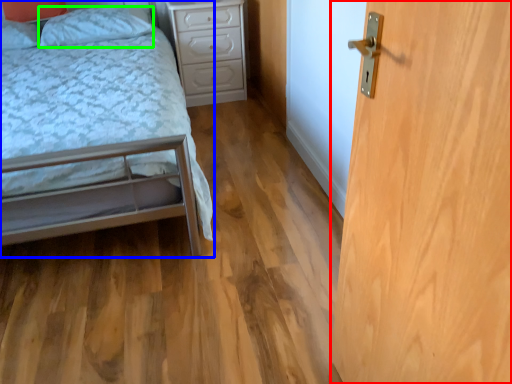
Question: Estimate the real-world distances between objects in this image. Which object is closer to door (highlighted by a red box), bed (highlighted by a blue box) or pillow (highlighted by a green box)?

Choices:
 (A) bed
 (B) pillow

Answer: (A)